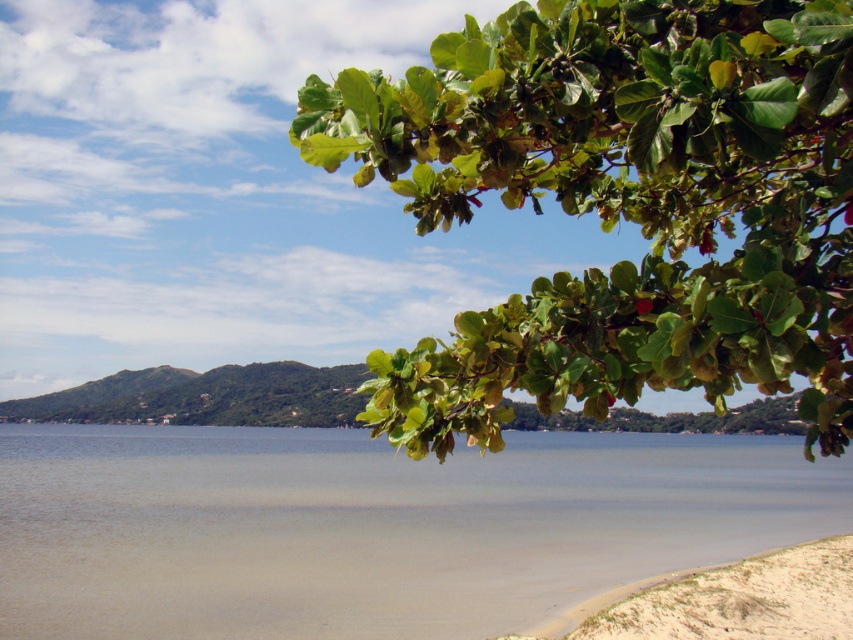
Can you confirm if green leafy branch at upper right is positioned to the left of white sandy beach at lower right?

Indeed, green leafy branch at upper right is positioned on the left side of white sandy beach at lower right.

Between green leafy branch at upper right and white sandy beach at lower right, which one is positioned lower?

white sandy beach at lower right is lower down.

Between point (767, 301) and point (834, 616), which one is positioned in front?

Point (767, 301)

This screenshot has height=640, width=853. I want to click on green leafy branch at upper right, so click(622, 204).

Consider the image. Is the position of green leafy branch at upper right less distant than that of clear water at lower left?

Yes.

Does point (532, 120) lie behind point (9, 449)?

No, (532, 120) is in front of (9, 449).

Does point (450, 129) lie behind point (334, 593)?

No, it is in front of (334, 593).

At what (x,y) coordinates should I click in order to perform the action: click on green leafy branch at upper right. Please return your answer as a coordinate pair (x, y). Looking at the image, I should click on (622, 204).

Is clear water at lower left behind white sandy beach at lower right?

Yes, it is.

Does clear water at lower left have a smaller size compared to white sandy beach at lower right?

No.

Is point (138, 563) positioned behind point (819, 560)?

That is True.

Identify the location of clear water at lower left. This screenshot has height=640, width=853. (373, 525).